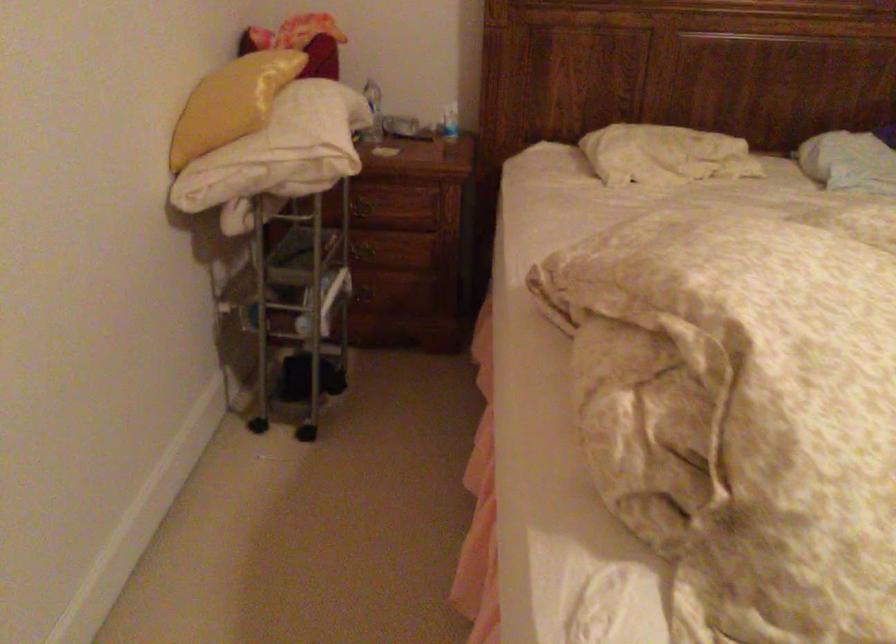
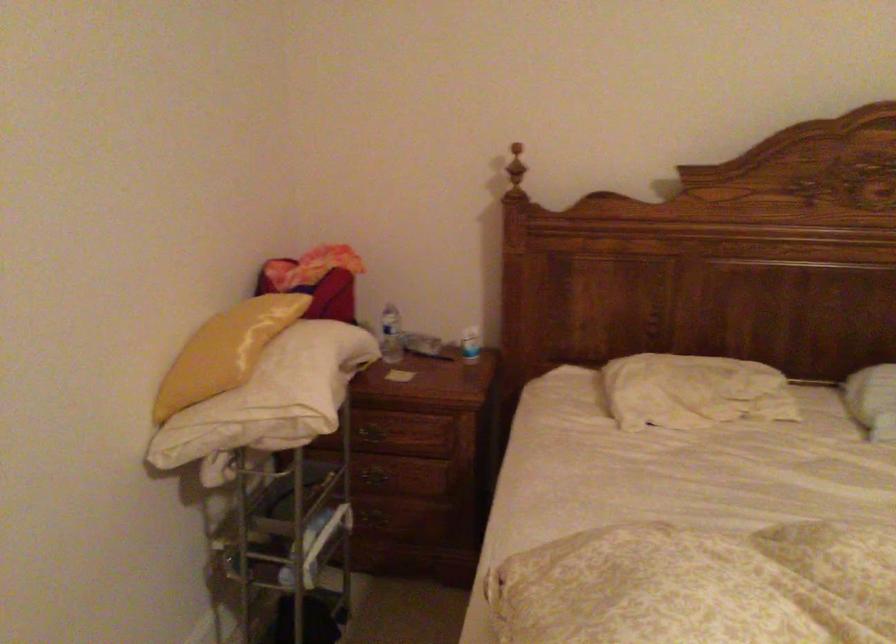
In the second image, find the point that corresponds to pixel 366 205 in the first image.

(374, 430)